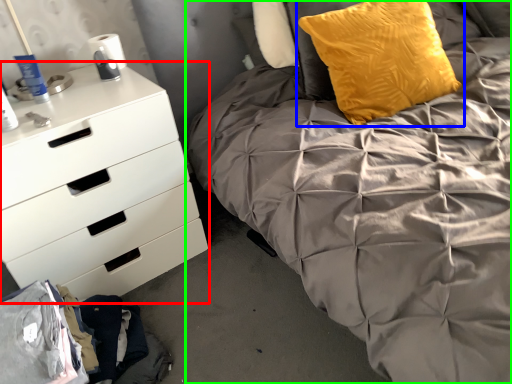
Question: Based on their relative distances, which object is farther from chest of drawers (highlighted by a red box)? Choose from pillow (highlighted by a blue box) and bed (highlighted by a green box).

Choices:
 (A) pillow
 (B) bed

Answer: (A)